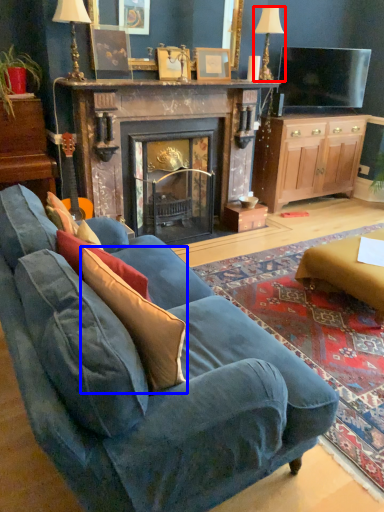
Question: Among these objects, which one is nearest to the camera, lamp (highlighted by a red box) or throw pillow (highlighted by a blue box)?

Choices:
 (A) lamp
 (B) throw pillow

Answer: (B)